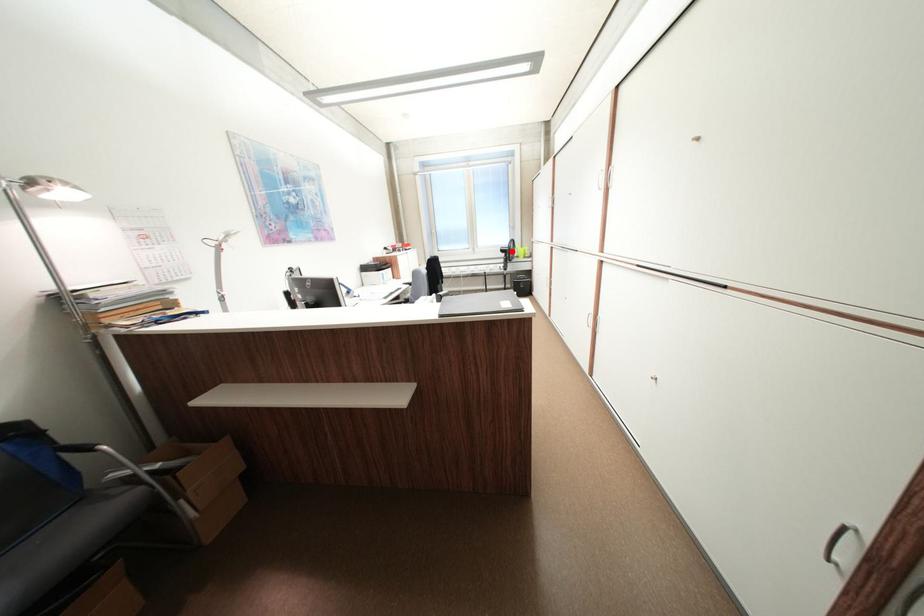
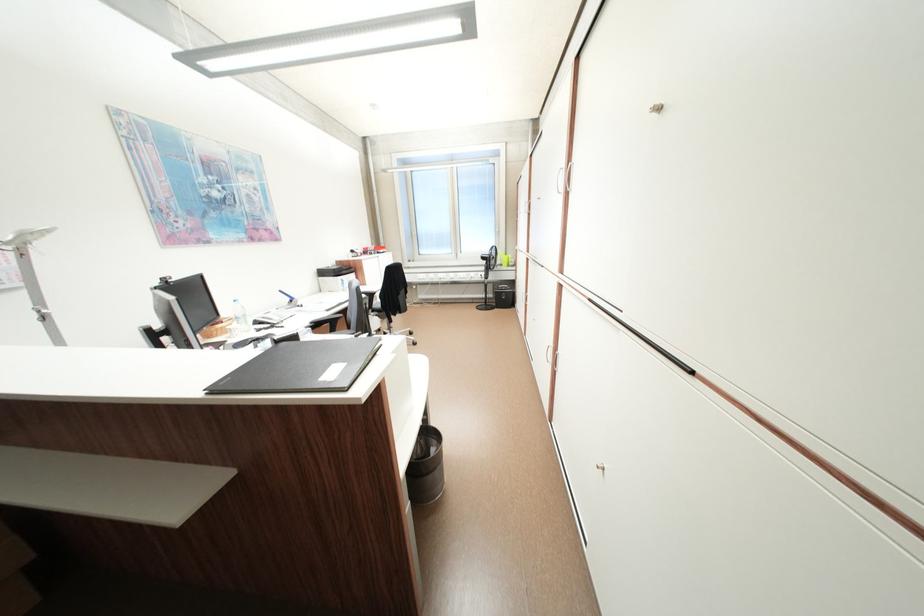
Question: I am providing you with two images of the same scene from different viewpoints. Image1 has a red point marked. In image2, the corresponding 3D location appears at what relative position? Reply with the corresponding letter.

Choices:
 (A) Closer
 (B) Farther

Answer: (B)